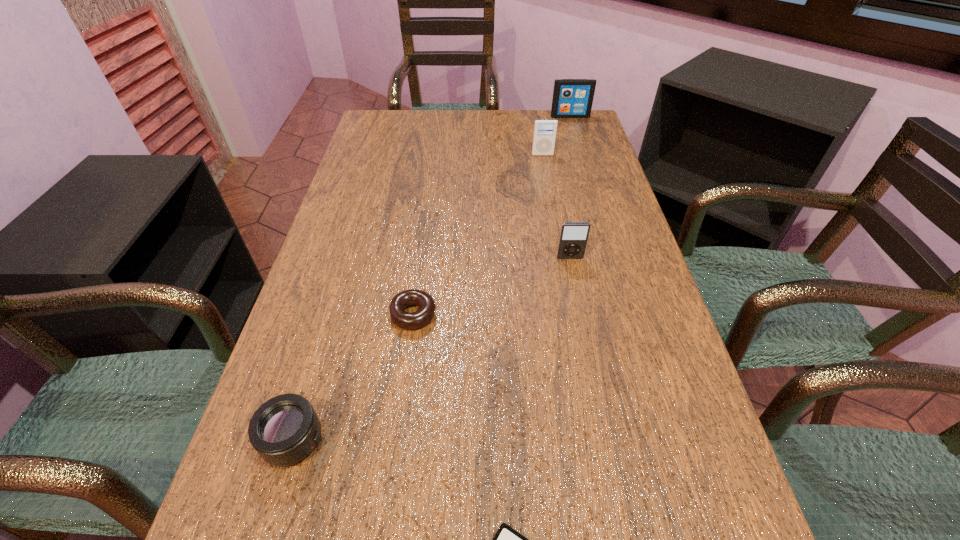
Where is `free region located 0.110m on the front-facing side of the third farthest iPod`? The width and height of the screenshot is (960, 540). free region located 0.110m on the front-facing side of the third farthest iPod is located at coordinates (577, 295).

Find the location of a particular element. This screenshot has height=540, width=960. free space located 0.130m on the side of the third shortest object with brand markings and control switches is located at coordinates (403, 440).

I want to click on vacant region located 0.070m on the left of the fifth object from right to left, so click(x=356, y=314).

Locate an element on the screen. object present at the far edge is located at coordinates (572, 98).

In order to click on object that is at the left edge in this screenshot , I will do `click(284, 430)`.

Find the location of a particular element. This screenshot has height=540, width=960. object present at the far right corner is located at coordinates (572, 98).

Where is `free space at the far edge of the desktop`? Image resolution: width=960 pixels, height=540 pixels. free space at the far edge of the desktop is located at coordinates (502, 135).

In the image, there is a desktop. At what (x,y) coordinates should I click in order to perform the action: click on vacant space at the left edge. Please return your answer as a coordinate pair (x, y). The image size is (960, 540). Looking at the image, I should click on (372, 286).

The image size is (960, 540). Find the location of `free point at the right edge`. free point at the right edge is located at coordinates (629, 416).

Where is `vacant region at the far left corner of the desktop`? vacant region at the far left corner of the desktop is located at coordinates (371, 141).